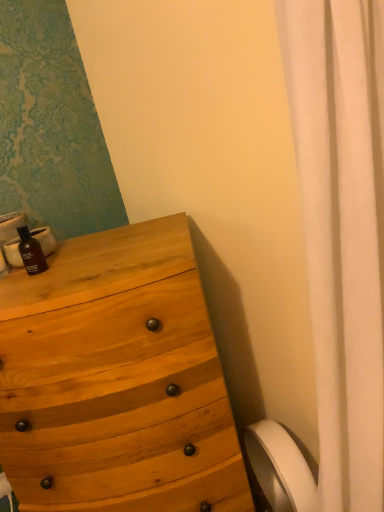
Where is `vacant space in front of matte black bottle at left`? This screenshot has width=384, height=512. vacant space in front of matte black bottle at left is located at coordinates (41, 295).